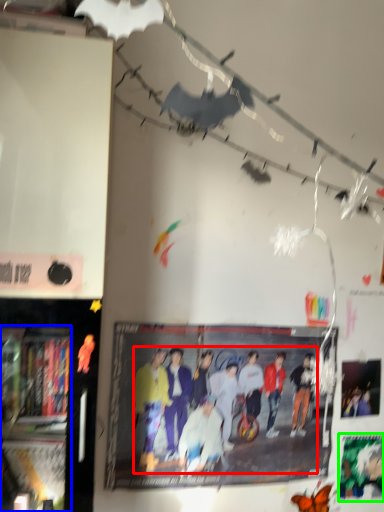
Question: Based on their relative distances, which object is farther from person (highlighted by a red box)? Choose from bookshelf (highlighted by a blue box) and poster page (highlighted by a green box).

Choices:
 (A) bookshelf
 (B) poster page

Answer: (B)